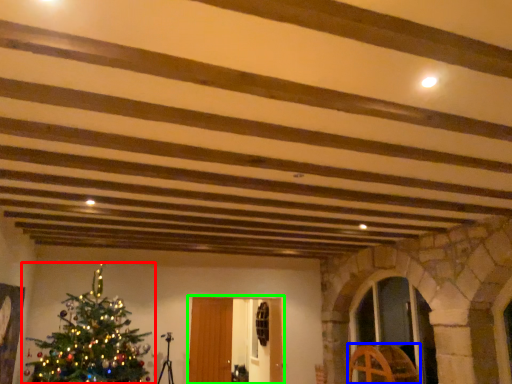
Question: Which object is the closest to the christmas tree (highlighted by a red box)? Choose among these: furniture (highlighted by a blue box) or glass door (highlighted by a green box).

Choices:
 (A) furniture
 (B) glass door

Answer: (B)